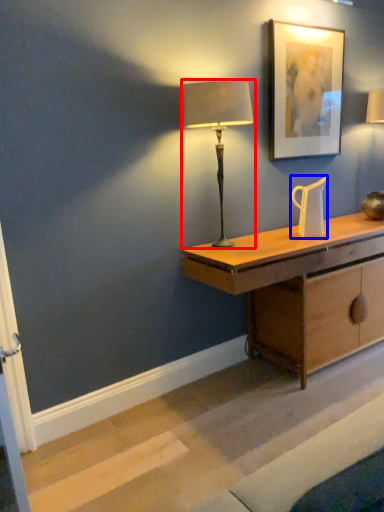
Question: Which object appears closest to the camera in this image, lamp (highlighted by a red box) or jug (highlighted by a blue box)?

Choices:
 (A) lamp
 (B) jug

Answer: (A)